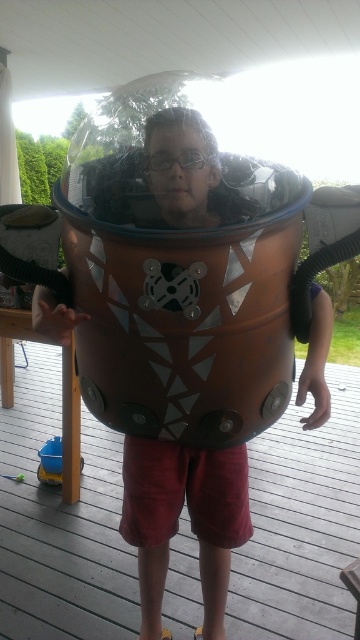
Based on the photo, who is shorter, matte brown helmet at center or blue plastic toy at lower left?

Standing shorter between the two is blue plastic toy at lower left.

Which is above, matte brown helmet at center or blue plastic toy at lower left?

matte brown helmet at center

Between point (316, 385) and point (46, 456), which one is positioned behind?

The point (46, 456) is more distant.

I want to click on matte brown helmet at center, so click(x=317, y=364).